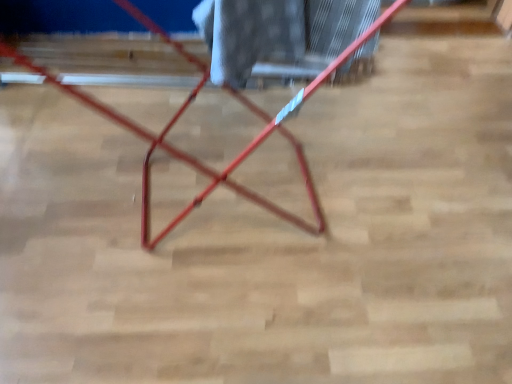
Locate an element on the screen. This screenshot has height=384, width=512. free space behind metallic red ladder at center is located at coordinates (194, 97).